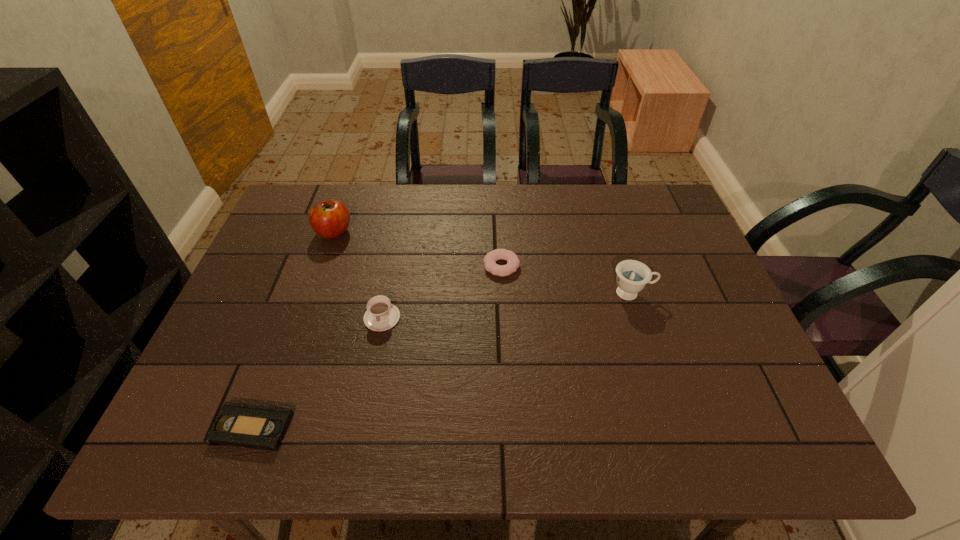
This screenshot has height=540, width=960. What are the coordinates of `free space between the fourth tallest object and the shorter teacup` in the screenshot? It's located at (442, 292).

Where is `empty space between the doughnut and the third shortest object`? The width and height of the screenshot is (960, 540). empty space between the doughnut and the third shortest object is located at coordinates (442, 292).

In order to click on free space that is in between the nearest object and the left teacup in this screenshot , I will do `click(318, 373)`.

Locate an element on the screen. The height and width of the screenshot is (540, 960). free space between the apple and the third shortest object is located at coordinates (358, 275).

The width and height of the screenshot is (960, 540). What are the coordinates of `free space between the rightmost object and the apple` in the screenshot? It's located at (483, 262).

At what (x,y) coordinates should I click in order to perform the action: click on empty space between the farthest object and the fourth shortest object. Please return your answer as a coordinate pair (x, y). This screenshot has width=960, height=540. Looking at the image, I should click on (483, 262).

At what (x,y) coordinates should I click in order to perform the action: click on object that is the third closest to the right teacup. Please return your answer as a coordinate pair (x, y). Looking at the image, I should click on (329, 219).

Identify which object is the second closest to the rightmost object. Please provide its 2D coordinates. Your answer should be formatted as a tuple, i.e. [(x, y)], where the tuple contains the x and y coordinates of a point satisfying the conditions above.

[(381, 315)]

At what (x,y) coordinates should I click in order to perform the action: click on free point that satisfies the following two spatial constraints: 1. on the side of the second tallest object with the handle; 2. on the handle side of the left teacup. Please return your answer as a coordinate pair (x, y). The width and height of the screenshot is (960, 540). Looking at the image, I should click on (639, 318).